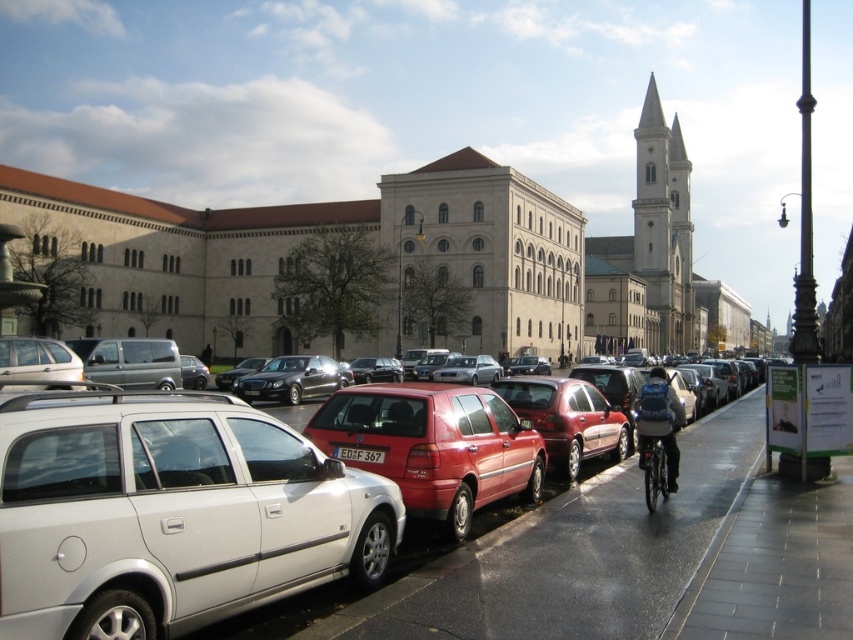
Is matte red hatchback at center wider than white plastic license plate at center?

Yes, matte red hatchback at center is wider than white plastic license plate at center.

Is matte red hatchback at center above white plastic license plate at center?

Incorrect, matte red hatchback at center is not positioned above white plastic license plate at center.

Does point (180, 630) come closer to viewer compared to point (364, 456)?

Yes.

You are a GUI agent. You are given a task and a screenshot of the screen. Output one action in this format:
    pyautogui.click(x=<x>, y=<y>)
    Task: Click on the matte red hatchback at center
    This screenshot has height=640, width=853.
    Given the screenshot: What is the action you would take?
    pos(169,515)

Is matte red hatchback at center shorter than metallic silver bicycle at right?

No, matte red hatchback at center is not shorter than metallic silver bicycle at right.

In the scene shown: Is matte red hatchback at center thinner than metallic silver bicycle at right?

In fact, matte red hatchback at center might be wider than metallic silver bicycle at right.

The width and height of the screenshot is (853, 640). What are the coordinates of `matte red hatchback at center` in the screenshot? It's located at (169, 515).

Who is more distant from viewer, (672,449) or (347,460)?

The point (672,449) is more distant.

Can you confirm if metallic silver bicycle at right is taller than white plastic license plate at center?

No.

This screenshot has height=640, width=853. I want to click on metallic silver bicycle at right, so click(x=656, y=465).

Locate an element on the screen. metallic silver bicycle at right is located at coordinates (656, 465).